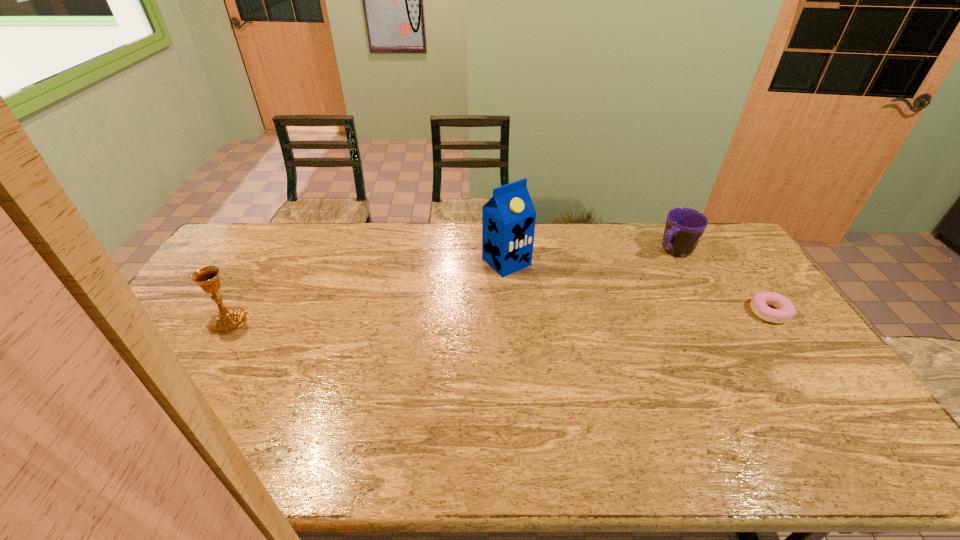
You are a GUI agent. You are given a task and a screenshot of the screen. Output one action in this format:
    pyautogui.click(x=<x>, y=<y>)
    Task: Click on the free location located with the cap open on the second object from left to right
    Image resolution: width=960 pixels, height=540 pixels.
    Given the screenshot: What is the action you would take?
    pyautogui.click(x=557, y=308)

This screenshot has height=540, width=960. I want to click on free region located 0.230m with the cap open on the second object from left to right, so click(x=565, y=315).

Locate an element on the screen. vacant space located 0.090m with the cap open on the second object from left to right is located at coordinates (538, 290).

Where is `free space located 0.370m with the handle on the side of the second object from right to left`? Image resolution: width=960 pixels, height=540 pixels. free space located 0.370m with the handle on the side of the second object from right to left is located at coordinates (592, 303).

Locate an element on the screen. The width and height of the screenshot is (960, 540). vacant space located 0.070m with the handle on the side of the second object from right to left is located at coordinates (648, 266).

You are a GUI agent. You are given a task and a screenshot of the screen. Output one action in this format:
    pyautogui.click(x=<x>, y=<y>)
    Task: Click on the vacant space located 0.230m with the handle on the side of the second object from right to left
    The height and width of the screenshot is (540, 960).
    Given the screenshot: What is the action you would take?
    pyautogui.click(x=620, y=285)

The height and width of the screenshot is (540, 960). Find the location of `carton located at the far edge`. carton located at the far edge is located at coordinates (508, 219).

What are the coordinates of `mug that is at the far edge` in the screenshot? It's located at (684, 227).

Locate an element on the screen. Image resolution: width=960 pixels, height=540 pixels. object present at the left edge is located at coordinates (227, 319).

This screenshot has height=540, width=960. In order to click on pastry present at the right edge in this screenshot , I will do `click(759, 303)`.